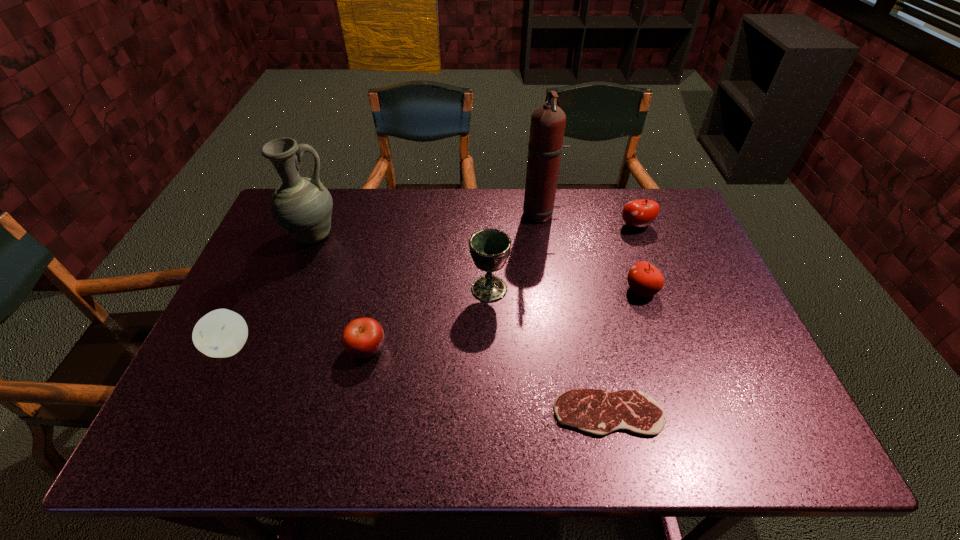
Locate an element on the screen. This screenshot has height=540, width=960. free space between the chalice and the tallest object is located at coordinates click(x=515, y=252).

The width and height of the screenshot is (960, 540). I want to click on vacant area between the farthest apple and the fifth object from right to left, so click(563, 258).

Locate an element on the screen. This screenshot has height=540, width=960. unoccupied position between the leftmost apple and the sixth object from right to left is located at coordinates (299, 347).

Select which object is the fifth closest to the seventh shortest object. Please provide its 2D coordinates. Your answer should be formatted as a tuple, i.e. [(x, y)], where the tuple contains the x and y coordinates of a point satisfying the conditions above.

[(597, 412)]

Identify which object is located as the fifth nearest to the fourth object from left to right. Please provide its 2D coordinates. Your answer should be formatted as a tuple, i.e. [(x, y)], where the tuple contains the x and y coordinates of a point satisfying the conditions above.

[(639, 213)]

Where is `apple that is the third nearest to the third nearest apple`? This screenshot has height=540, width=960. apple that is the third nearest to the third nearest apple is located at coordinates (221, 333).

Identify which apple is the second closest to the nearest object. Please provide its 2D coordinates. Your answer should be formatted as a tuple, i.e. [(x, y)], where the tuple contains the x and y coordinates of a point satisfying the conditions above.

[(362, 338)]

Find the location of `vacant position in the image that satisfies the following two spatial constraints: 1. on the handle side of the second tallest object; 2. on the right side of the nearest object`. vacant position in the image that satisfies the following two spatial constraints: 1. on the handle side of the second tallest object; 2. on the right side of the nearest object is located at coordinates 241,413.

Locate an element on the screen. This screenshot has width=960, height=540. vacant region that satisfies the following two spatial constraints: 1. on the side of the fire extinguisher with the label and nozzle; 2. on the back side of the farthest apple is located at coordinates (542, 226).

Locate an element on the screen. This screenshot has height=540, width=960. vacant space that satisfies the following two spatial constraints: 1. on the handle side of the pitcher; 2. on the right side of the nearest object is located at coordinates (241, 413).